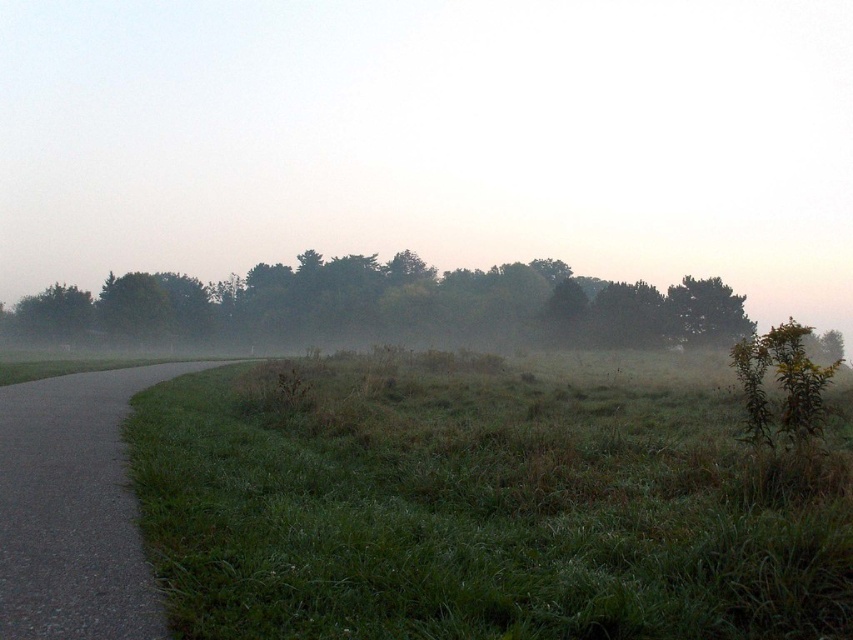
The image size is (853, 640). What do you see at coordinates (386, 305) in the screenshot?
I see `green matte trees at center` at bounding box center [386, 305].

Can you confirm if green matte trees at center is wider than gray asphalt path at left?

Yes, green matte trees at center is wider than gray asphalt path at left.

Is point (173, 301) farther from camera compared to point (38, 384)?

Yes, point (173, 301) is behind point (38, 384).

Image resolution: width=853 pixels, height=640 pixels. Identify the location of green matte trees at center. (386, 305).

Between point (689, 612) and point (21, 324), which one is positioned in front?

Point (689, 612)

This screenshot has height=640, width=853. What do you see at coordinates (479, 508) in the screenshot? I see `green grassy at lower left` at bounding box center [479, 508].

Identify the location of green grassy at lower left. (479, 508).

Which is above, green grassy at lower left or gray asphalt path at left?

Positioned higher is green grassy at lower left.

The width and height of the screenshot is (853, 640). What do you see at coordinates (479, 508) in the screenshot? I see `green grassy at lower left` at bounding box center [479, 508].

Which is behind, point (279, 532) or point (54, 429)?

Point (54, 429)

Identify the location of green grassy at lower left. The height and width of the screenshot is (640, 853). (479, 508).